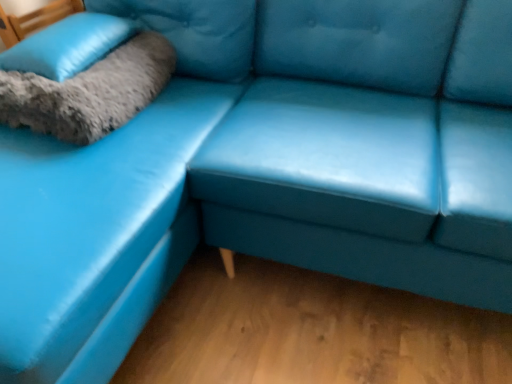
The width and height of the screenshot is (512, 384). What are the coordinates of `gray fluffy pillow at upper left` in the screenshot? It's located at (90, 92).

Find the location of `soft gray fur pillow at upper left`. soft gray fur pillow at upper left is located at coordinates (69, 45).

Choose the correct answer: Is soft gray fur pillow at upper left inside gray fluffy pillow at upper left or outside it?

soft gray fur pillow at upper left is located inside gray fluffy pillow at upper left.

Would you say soft gray fur pillow at upper left is a long distance from gray fluffy pillow at upper left?

No, soft gray fur pillow at upper left is not far from gray fluffy pillow at upper left.

Which object is closer to the camera, soft gray fur pillow at upper left or gray fluffy pillow at upper left?

Positioned in front is gray fluffy pillow at upper left.

Can you confirm if soft gray fur pillow at upper left is positioned to the left of gray fluffy pillow at upper left?

Correct, you'll find soft gray fur pillow at upper left to the left of gray fluffy pillow at upper left.

Considering the sizes of soft gray fur pillow at upper left and matte blue leather couch at center in the image, is soft gray fur pillow at upper left taller or shorter than matte blue leather couch at center?

In the image, soft gray fur pillow at upper left appears to be shorter than matte blue leather couch at center.

Is soft gray fur pillow at upper left positioned with its back to matte blue leather couch at center?

Yes, soft gray fur pillow at upper left's orientation is away from matte blue leather couch at center.

How different are the orientations of soft gray fur pillow at upper left and matte blue leather couch at center in degrees?

They differ by 2.09 degrees in their facing directions.

At what (x,y) coordinates should I click in order to perform the action: click on pillow positioned vertically above the matte blue leather couch at center (from a real-world perspective). Please return your answer as a coordinate pair (x, y). The width and height of the screenshot is (512, 384). Looking at the image, I should click on (69, 45).

Are matte blue leather couch at center and gray fluffy pillow at upper left beside each other?

They are not placed beside each other.

In terms of height, does matte blue leather couch at center look taller or shorter compared to gray fluffy pillow at upper left?

Considering their sizes, matte blue leather couch at center has more height than gray fluffy pillow at upper left.

Is matte blue leather couch at center behind gray fluffy pillow at upper left?

No, matte blue leather couch at center is in front of gray fluffy pillow at upper left.

How different are the orientations of matte blue leather couch at center and gray fluffy pillow at upper left in degrees?

The angular difference between matte blue leather couch at center and gray fluffy pillow at upper left is 0.8 degrees.

The image size is (512, 384). In order to click on pillow behind the gray fluffy pillow at upper left in this screenshot , I will do `click(69, 45)`.

Can you confirm if gray fluffy pillow at upper left is positioned to the left of soft gray fur pillow at upper left?

No.

From the image's perspective, does gray fluffy pillow at upper left appear higher than soft gray fur pillow at upper left?

Actually, gray fluffy pillow at upper left appears below soft gray fur pillow at upper left in the image.

Considering the relative sizes of gray fluffy pillow at upper left and soft gray fur pillow at upper left in the image provided, is gray fluffy pillow at upper left thinner than soft gray fur pillow at upper left?

Correct, the width of gray fluffy pillow at upper left is less than that of soft gray fur pillow at upper left.

Is gray fluffy pillow at upper left closer to the viewer compared to matte blue leather couch at center?

No, it is behind matte blue leather couch at center.

From the image's perspective, who appears lower, gray fluffy pillow at upper left or matte blue leather couch at center?

matte blue leather couch at center.

Where is `blanket positioned vertically above the matte blue leather couch at center (from a real-world perspective)`? The height and width of the screenshot is (384, 512). blanket positioned vertically above the matte blue leather couch at center (from a real-world perspective) is located at coordinates (90, 92).

Measure the distance between gray fluffy pillow at upper left and matte blue leather couch at center.

They are 6.92 inches apart.

From the image's perspective, is matte blue leather couch at center located beneath soft gray fur pillow at upper left?

Yes.

You are a GUI agent. You are given a task and a screenshot of the screen. Output one action in this format:
    pyautogui.click(x=<x>, y=<y>)
    Task: Click on the couch below the soft gray fur pillow at upper left (from a real-world perspective)
    
    Given the screenshot: What is the action you would take?
    click(x=108, y=190)

Is matte blue leather couch at center inside or outside of soft gray fur pillow at upper left?

matte blue leather couch at center is not inside soft gray fur pillow at upper left, it's outside.

Based on their sizes in the image, would you say matte blue leather couch at center is bigger or smaller than soft gray fur pillow at upper left?

In the image, matte blue leather couch at center appears to be larger than soft gray fur pillow at upper left.

Identify the location of blanket on the right of soft gray fur pillow at upper left. This screenshot has height=384, width=512. (90, 92).

There is a matte blue leather couch at center. At what (x,y) coordinates should I click in order to perform the action: click on pillow above it (from a real-world perspective). Please return your answer as a coordinate pair (x, y). Looking at the image, I should click on (69, 45).

Estimate the real-world distances between objects in this image. Which object is further from soft gray fur pillow at upper left, gray fluffy pillow at upper left or matte blue leather couch at center?

matte blue leather couch at center is further to soft gray fur pillow at upper left.

Considering their positions, is gray fluffy pillow at upper left positioned closer to matte blue leather couch at center than soft gray fur pillow at upper left?

Among the two, gray fluffy pillow at upper left is located nearer to matte blue leather couch at center.

Estimate the real-world distances between objects in this image. Which object is further from gray fluffy pillow at upper left, matte blue leather couch at center or soft gray fur pillow at upper left?

Among the two, matte blue leather couch at center is located further to gray fluffy pillow at upper left.

Which object lies further to the anchor point soft gray fur pillow at upper left, matte blue leather couch at center or gray fluffy pillow at upper left?

The object further to soft gray fur pillow at upper left is matte blue leather couch at center.

Considering their positions, is soft gray fur pillow at upper left positioned closer to gray fluffy pillow at upper left than matte blue leather couch at center?

soft gray fur pillow at upper left.

Based on the photo, based on their spatial positions, is soft gray fur pillow at upper left or gray fluffy pillow at upper left further from matte blue leather couch at center?

Based on the image, soft gray fur pillow at upper left appears to be further to matte blue leather couch at center.

At what (x,y) coordinates should I click in order to perform the action: click on blanket positioned between matte blue leather couch at center and soft gray fur pillow at upper left from near to far. Please return your answer as a coordinate pair (x, y). The width and height of the screenshot is (512, 384). Looking at the image, I should click on (90, 92).